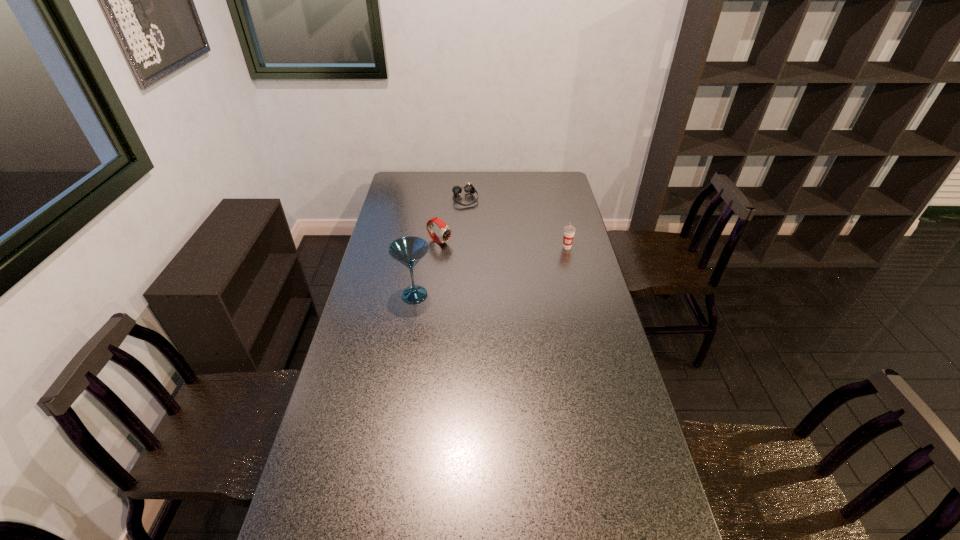
This screenshot has height=540, width=960. I want to click on empty location between the second shortest object and the rightmost object, so click(503, 245).

I want to click on empty space between the tallest object and the goggles, so click(x=440, y=247).

Locate an element on the screen. The height and width of the screenshot is (540, 960). vacant area that lies between the farthest object and the rightmost object is located at coordinates (516, 223).

Where is `free space between the goggles and the cup`? free space between the goggles and the cup is located at coordinates click(516, 223).

The image size is (960, 540). I want to click on the second closest object relative to the nearest object, so click(x=468, y=188).

Select which object is the closest to the goggles. Please provide its 2D coordinates. Your answer should be formatted as a tuple, i.e. [(x, y)], where the tuple contains the x and y coordinates of a point satisfying the conditions above.

[(445, 233)]

This screenshot has height=540, width=960. I want to click on free spot that satisfies the following two spatial constraints: 1. on the back side of the watch; 2. on the left side of the farthest object, so click(x=444, y=199).